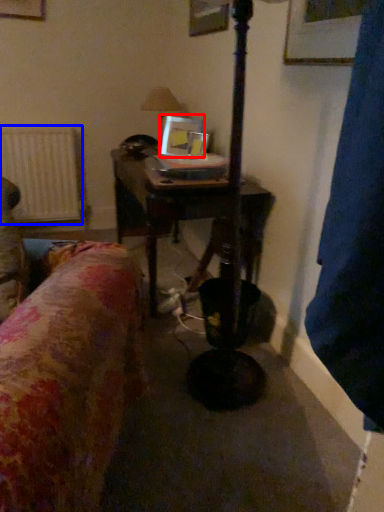
Question: Among these objects, which one is farthest to the camera, picture frame (highlighted by a red box) or radiator (highlighted by a blue box)?

Choices:
 (A) picture frame
 (B) radiator

Answer: (B)